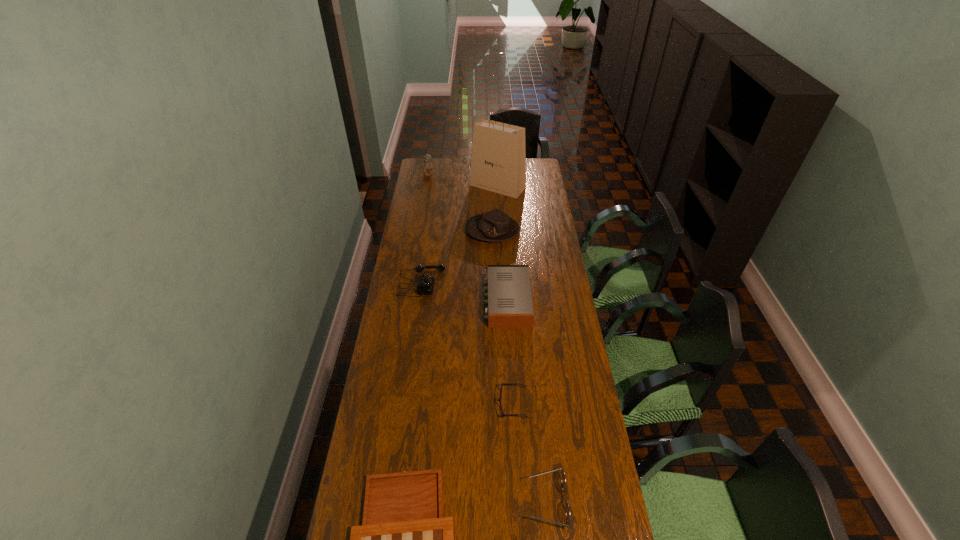
I want to click on blank region between the tallest object and the telephone, so click(460, 234).

This screenshot has width=960, height=540. Identify the location of free space between the telephone and the third farthest object. (457, 256).

At what (x,y) coordinates should I click in order to perform the action: click on free space between the tallest object and the hat. Please return your answer as a coordinate pair (x, y). Looking at the image, I should click on (495, 208).

Find the location of `vacant area that lies between the sixth shortest object and the shopping bag`. vacant area that lies between the sixth shortest object and the shopping bag is located at coordinates (495, 208).

Find the location of a particular element. This screenshot has width=960, height=540. free space between the seventh shortest object and the telephone is located at coordinates (425, 228).

Find the location of `free space between the taller spectacles and the telephone`. free space between the taller spectacles and the telephone is located at coordinates (484, 392).

This screenshot has width=960, height=540. What are the coordinates of `free spot between the telephone and the radio receiver` in the screenshot? It's located at (465, 292).

Choose which object is the fourth nearest neighbor to the shortest object. Please provide its 2D coordinates. Your answer should be formatted as a tuple, i.e. [(x, y)], where the tuple contains the x and y coordinates of a point satisfying the conditions above.

[(425, 285)]

Locate an element on the screen. The image size is (960, 540). the second closest object to the gameboard is located at coordinates (499, 399).

I want to click on free location that satisfies the following two spatial constraints: 1. on the front side of the tallest object; 2. on the decorative side of the sixth nearest object, so click(x=500, y=231).